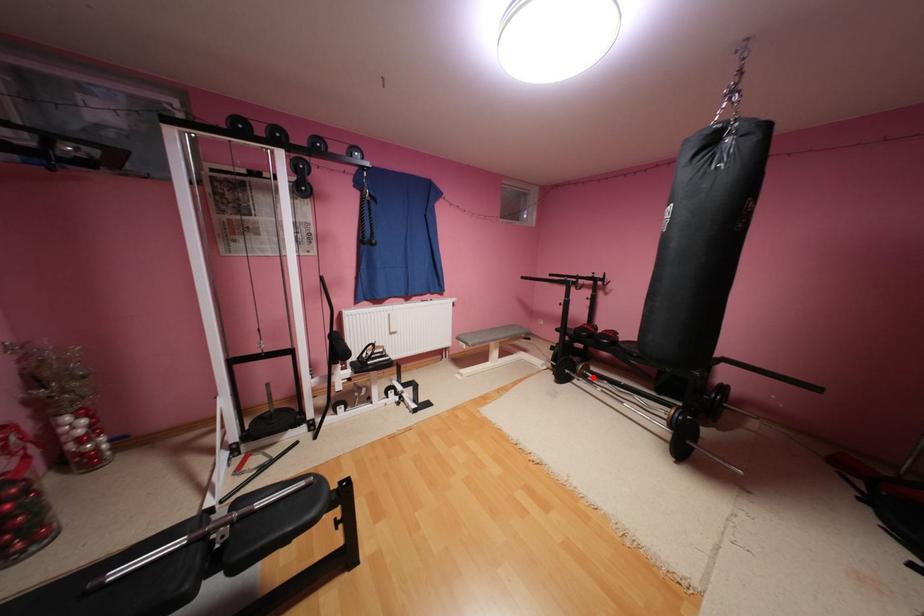
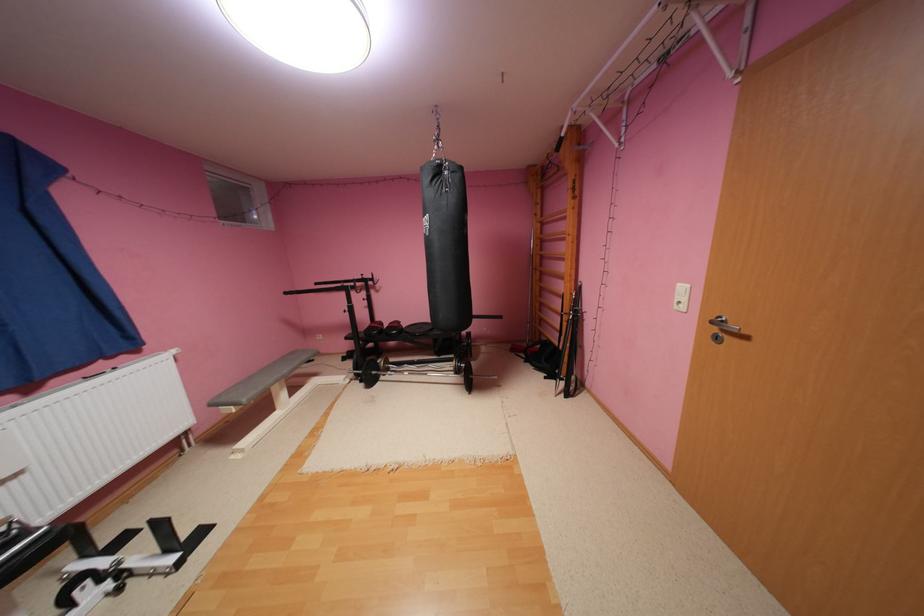
Find the pixel in the second image that matches the highlighted location in the first image.

(396, 371)